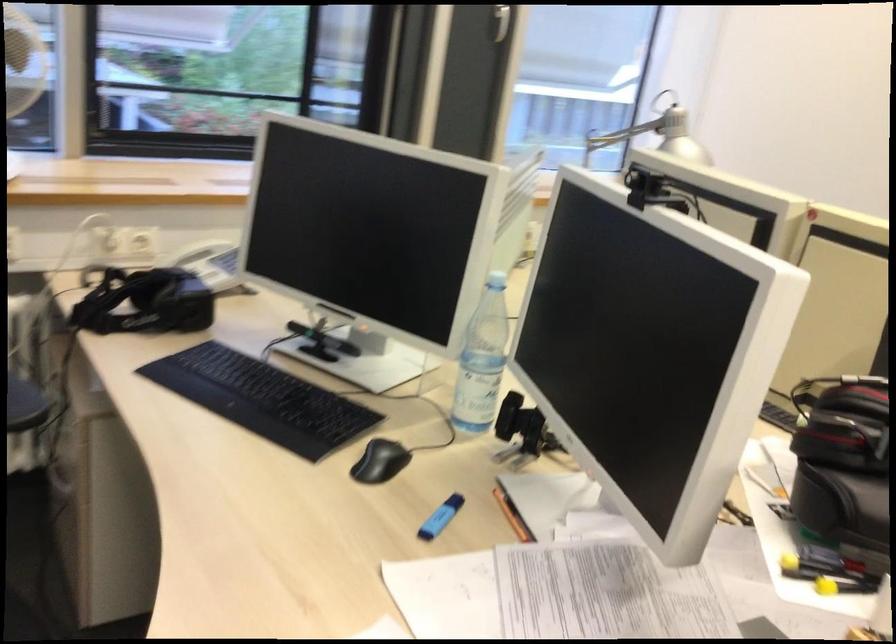
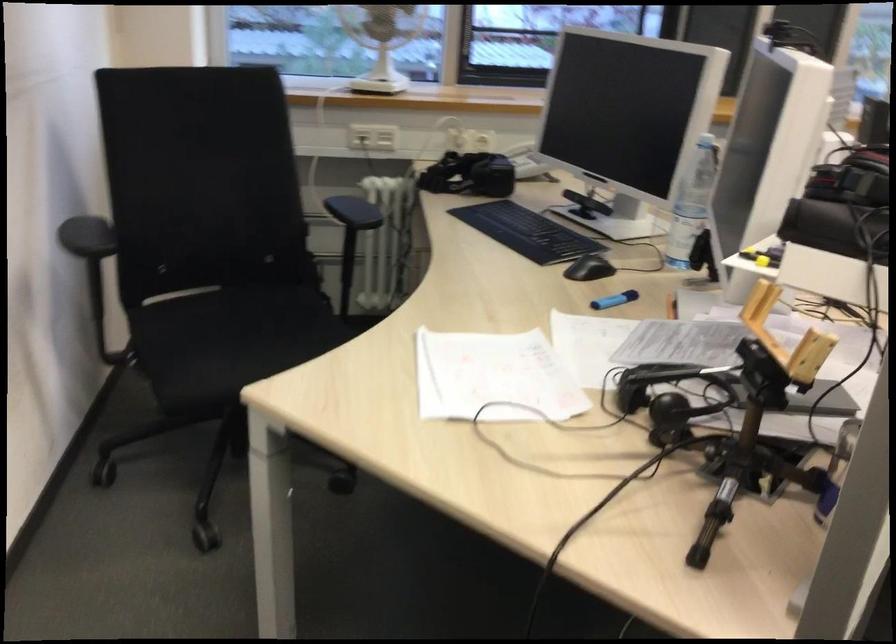
Locate, in the second image, the point that corresponds to (x=385, y=464) in the first image.

(589, 268)